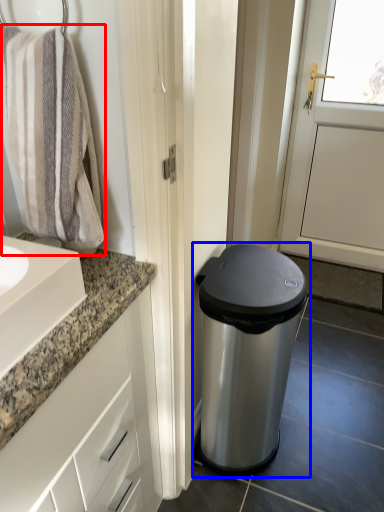
Question: Which object appears farthest to the camera in this image, bath towel (highlighted by a red box) or waste container (highlighted by a blue box)?

Choices:
 (A) bath towel
 (B) waste container

Answer: (B)